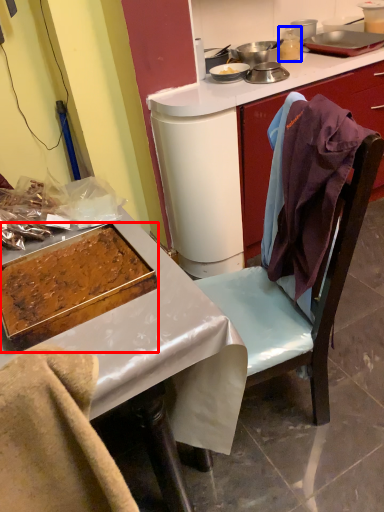
Question: Which object appears closest to the camera in this image, kitchen appliance (highlighted by a red box) or appliance (highlighted by a blue box)?

Choices:
 (A) kitchen appliance
 (B) appliance

Answer: (A)